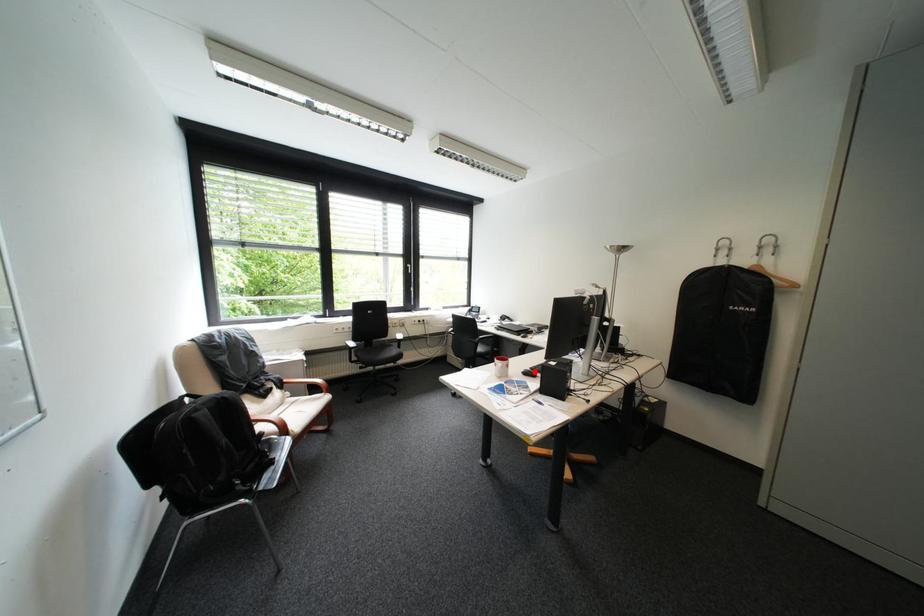
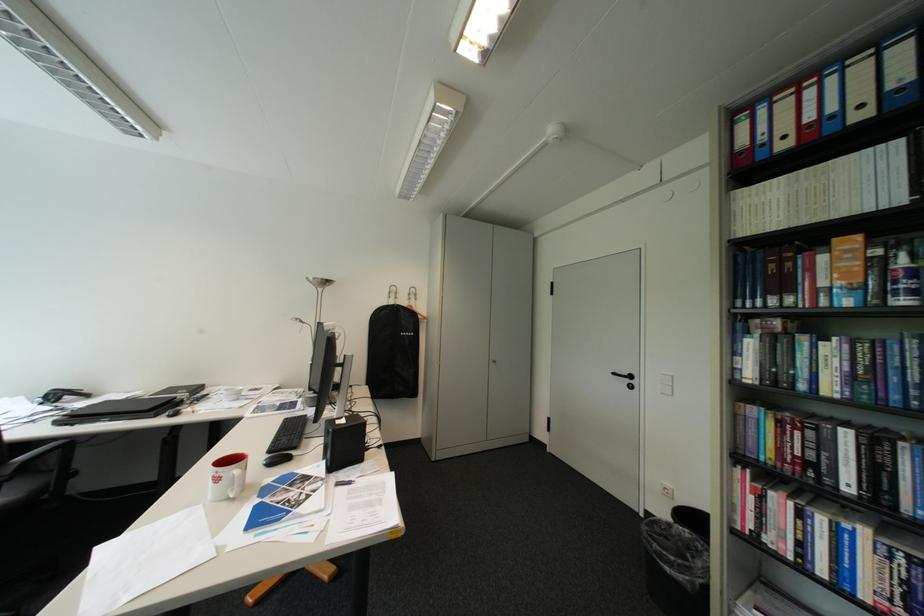
Where in the second image is the point corresponding to the highlighted location from the first image?

(276, 463)